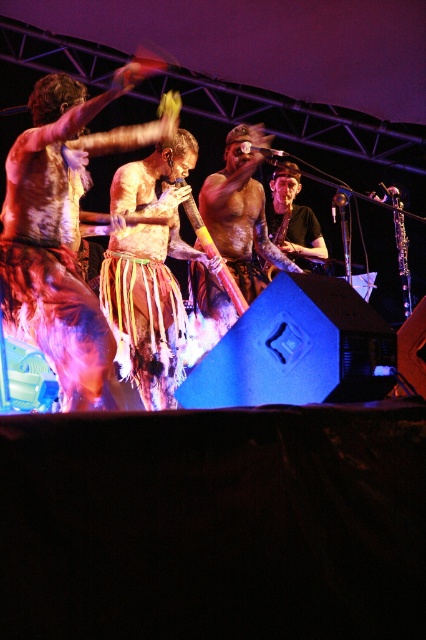
Question: Based on their relative distances, which object is nearer to the multicolored fringed skirt at center?

Choices:
 (A) shiny silver guitar at center
 (B) multicolored fabric skirt at center

Answer: (B)

Question: Does multicolored fabric skirt at center appear over shiny silver guitar at center?

Choices:
 (A) no
 (B) yes

Answer: (A)

Question: Does multicolored fringed skirt at center have a smaller size compared to shiny silver guitar at center?

Choices:
 (A) no
 (B) yes

Answer: (B)

Question: Among these points, which one is nearest to the camera?

Choices:
 (A) (25, 305)
 (B) (137, 202)

Answer: (A)

Question: Which of the following is the farthest from the observer?

Choices:
 (A) (293, 237)
 (B) (152, 296)
 (C) (57, 189)

Answer: (A)

Question: Is multicolored fabric skirt at center smaller than shiny silver guitar at center?

Choices:
 (A) no
 (B) yes

Answer: (A)